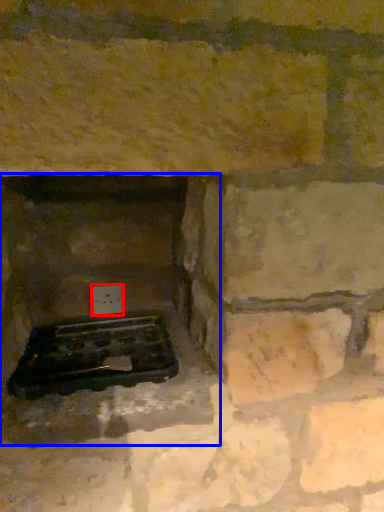
Question: Which point is closer to the camera, electric outlet (highlighted by a red box) or fireplace (highlighted by a blue box)?

Choices:
 (A) electric outlet
 (B) fireplace

Answer: (B)